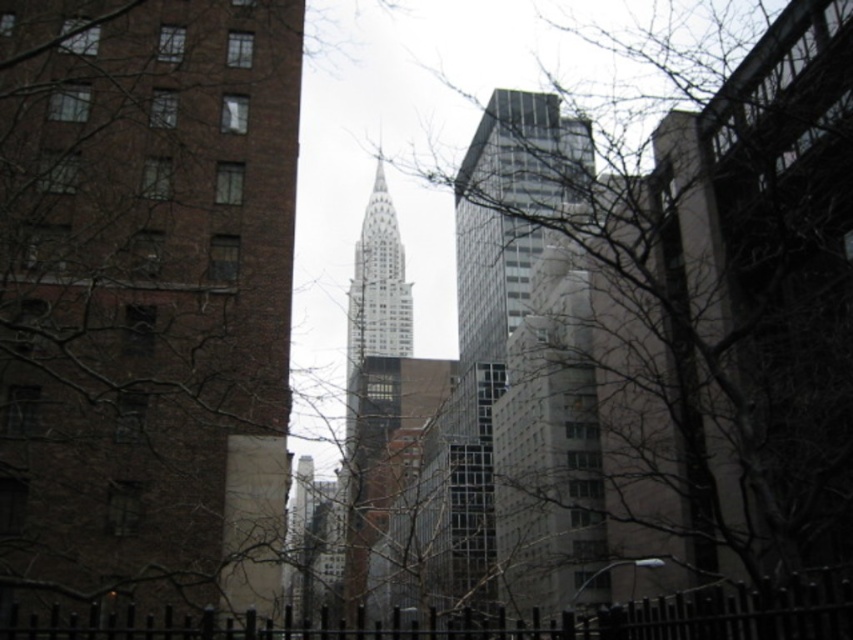
You are standing in the city looking at the skyscrapers. There are two points marked in the image, one at point coordinates point (x=782, y=484) and the other at point coordinates point (x=531, y=419). Which of these two points is closer to you?

Point (x=782, y=484) is closer to the camera than point (x=531, y=419), so the point at coordinates point (x=782, y=484) is closer to you.

You are standing in the city park and see the bare branches at center and the glassy steel skyscraper at center. Which object is higher in the scene?

The bare branches at center are higher than the glassy steel skyscraper at center because they are positioned above it in the scene.

You are a city planner analyzing the view of the cityscape. You notice the bare branches at center and the white glass tower at center. Which object is wider in this perspective?

The bare branches at center are wider than the white glass tower at center according to the description.